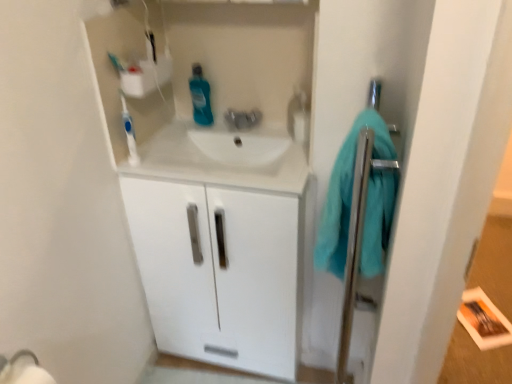
Identify the location of white glossy cabinet at center. The height and width of the screenshot is (384, 512). (218, 272).

Measure the distance between white glossy sink at center and camera.

The distance of white glossy sink at center from camera is 4.11 feet.

Measure the distance between blue glossy mouthwash at center and camera.

The distance of blue glossy mouthwash at center from camera is 5.26 feet.

The width and height of the screenshot is (512, 384). What do you see at coordinates (347, 192) in the screenshot?
I see `teal soft towel at right` at bounding box center [347, 192].

This screenshot has height=384, width=512. I want to click on white glossy cabinet at center, so click(218, 272).

Is white plastic toothbrush at upper left looking in the opposite direction of blue glossy mouthwash at center?

No, white plastic toothbrush at upper left's orientation is not away from blue glossy mouthwash at center.

Considering the positions of objects white plastic toothbrush at upper left and blue glossy mouthwash at center in the image provided, who is more to the right, white plastic toothbrush at upper left or blue glossy mouthwash at center?

blue glossy mouthwash at center is more to the right.

How distant is white plastic toothbrush at upper left from blue glossy mouthwash at center?

The distance of white plastic toothbrush at upper left from blue glossy mouthwash at center is 12.65 inches.

Is white plastic toothbrush at upper left smaller than blue glossy mouthwash at center?

Indeed, white plastic toothbrush at upper left has a smaller size compared to blue glossy mouthwash at center.

From the image's perspective, is blue glossy mouthwash at center on white glossy sink at center?

Yes, from the image's perspective, blue glossy mouthwash at center is above white glossy sink at center.

How many degrees apart are the facing directions of blue glossy mouthwash at center and white glossy sink at center?

The facing directions of blue glossy mouthwash at center and white glossy sink at center are 0.283 degrees apart.

Is blue glossy mouthwash at center in front of white glossy sink at center?

No, it is not.

Which point is more forward, (194, 93) or (138, 155)?

Point (138, 155)

Between blue glossy mouthwash at center and white plastic toothbrush at upper left, which one has more height?

With more height is white plastic toothbrush at upper left.

Is blue glossy mouthwash at center positioned with its back to white plastic toothbrush at upper left?

blue glossy mouthwash at center does not have its back to white plastic toothbrush at upper left.

Visually, is blue glossy mouthwash at center positioned to the left or to the right of white plastic toothbrush at upper left?

blue glossy mouthwash at center is positioned on white plastic toothbrush at upper left's right side.

Is white glossy cabinet at center at the back of white glossy sink at center?

Correct, white glossy sink at center is looking away from white glossy cabinet at center.

Is white glossy sink at center inside the boundaries of white glossy cabinet at center, or outside?

white glossy sink at center fits inside white glossy cabinet at center.

Between white glossy sink at center and white glossy cabinet at center, which one appears on the right side from the viewer's perspective?

white glossy cabinet at center is more to the right.

Can you confirm if white glossy sink at center is thinner than white glossy cabinet at center?

Correct, the width of white glossy sink at center is less than that of white glossy cabinet at center.

Which of these two, teal soft towel at right or blue glossy mouthwash at center, is bigger?

teal soft towel at right.

Is teal soft towel at right oriented away from blue glossy mouthwash at center?

teal soft towel at right is not turned away from blue glossy mouthwash at center.

Does point (367, 200) appear closer or farther from the camera than point (210, 114)?

Point (367, 200) appears to be closer to the viewer than point (210, 114).

From a real-world perspective, is teal soft towel at right positioned above or below blue glossy mouthwash at center?

In terms of real-world spatial position, teal soft towel at right is below blue glossy mouthwash at center.

Would you say white plastic toothbrush at upper left is part of white glossy cabinet at center's contents?

No, white plastic toothbrush at upper left is located outside of white glossy cabinet at center.

From the image's perspective, which is above, white glossy cabinet at center or white plastic toothbrush at upper left?

white plastic toothbrush at upper left.

Considering the sizes of objects white glossy cabinet at center and white plastic toothbrush at upper left in the image provided, who is smaller, white glossy cabinet at center or white plastic toothbrush at upper left?

white plastic toothbrush at upper left.

Is white glossy sink at center aimed at blue glossy mouthwash at center?

No, white glossy sink at center is not turned towards blue glossy mouthwash at center.

Is point (240, 153) farther from viewer compared to point (204, 86)?

No, it is in front of (204, 86).

Is white glossy sink at center smaller than blue glossy mouthwash at center?

Actually, white glossy sink at center might be larger than blue glossy mouthwash at center.

Which object is more forward, white glossy sink at center or blue glossy mouthwash at center?

white glossy sink at center is closer to the camera.

Identify the location of toothbrush that appears above the blue glossy mouthwash at center (from a real-world perspective). Image resolution: width=512 pixels, height=384 pixels. pyautogui.click(x=129, y=133).

The image size is (512, 384). Find the location of `counter top in front of the blue glossy mouthwash at center`. counter top in front of the blue glossy mouthwash at center is located at coordinates (221, 159).

From the picture: Looking at the image, which one is located closer to white plastic toothbrush at upper left, blue glossy mouthwash at center or white glossy sink at center?

white glossy sink at center.

Considering their positions, is white glossy cabinet at center positioned further to blue glossy mouthwash at center than white plastic toothbrush at upper left?

white glossy cabinet at center lies further to blue glossy mouthwash at center than the other object.

From the image, which object appears to be nearer to blue glossy mouthwash at center, white plastic toothbrush at upper left or white glossy sink at center?

white glossy sink at center.

From the image, which object appears to be nearer to white glossy cabinet at center, white plastic toothbrush at upper left or white glossy sink at center?

white glossy sink at center is positioned closer to the anchor white glossy cabinet at center.

Considering their positions, is white glossy sink at center positioned further to white plastic toothbrush at upper left than white glossy cabinet at center?

white glossy cabinet at center is positioned further to the anchor white plastic toothbrush at upper left.

Considering their positions, is teal soft towel at right positioned closer to blue glossy mouthwash at center than white glossy cabinet at center?

The object closer to blue glossy mouthwash at center is white glossy cabinet at center.

From the image, which object appears to be farther from blue glossy mouthwash at center, white plastic toothbrush at upper left or white glossy cabinet at center?

white glossy cabinet at center is further to blue glossy mouthwash at center.

Looking at the image, which one is located closer to teal soft towel at right, white glossy cabinet at center or blue glossy mouthwash at center?

white glossy cabinet at center is positioned closer to the anchor teal soft towel at right.

You are a GUI agent. You are given a task and a screenshot of the screen. Output one action in this format:
    pyautogui.click(x=<x>, y=<y>)
    Task: Click on the counter top between blue glossy mouthwash at center and white glossy cabinet at center vertically
    
    Given the screenshot: What is the action you would take?
    pyautogui.click(x=221, y=159)

At what (x,y) coordinates should I click in order to perform the action: click on toothbrush between white glossy sink at center and blue glossy mouthwash at center from front to back. Please return your answer as a coordinate pair (x, y). This screenshot has height=384, width=512. Looking at the image, I should click on (129, 133).

Find the location of a particular element. This screenshot has height=384, width=512. counter top between white plastic toothbrush at upper left and white glossy cabinet at center from top to bottom is located at coordinates (221, 159).

The image size is (512, 384). I want to click on counter top between white plastic toothbrush at upper left and teal soft towel at right from left to right, so click(x=221, y=159).